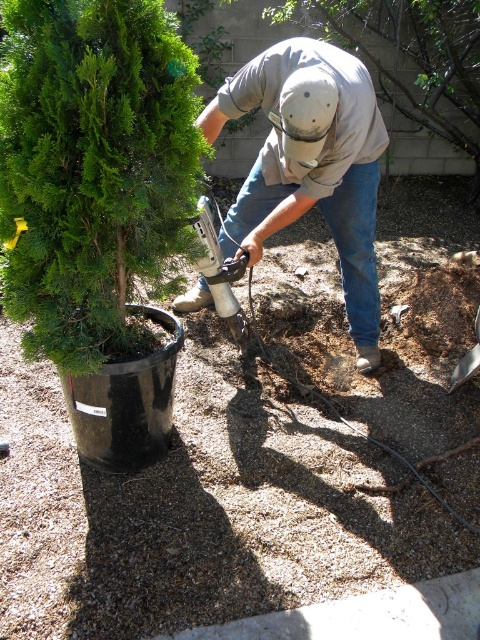
Does point (13, 68) lie behind point (391, 51)?

No, (13, 68) is closer to viewer.

Is green matte shrub at left taller than green matte tree at center?

Incorrect, green matte shrub at left's height is not larger of green matte tree at center's.

Between point (97, 33) and point (459, 124), which one is positioned in front?

Point (97, 33)

Locate an element on the screen. Image resolution: width=480 pixels, height=640 pixels. green matte shrub at left is located at coordinates (93, 166).

Between green matte shrub at left and gray fabric shirt at center, which one appears on the right side from the viewer's perspective?

From the viewer's perspective, gray fabric shirt at center appears more on the right side.

Between point (12, 177) and point (334, 225), which one is positioned in front?

Point (12, 177) is more forward.

The image size is (480, 640). Find the location of `green matte shrub at left`. green matte shrub at left is located at coordinates (93, 166).

Is point (285, 113) behind point (456, 19)?

No, it is in front of (456, 19).

Between gray fabric shirt at center and green matte tree at center, which one is positioned lower?

gray fabric shirt at center

Between point (245, 84) and point (396, 86), which one is positioned in front?

Point (245, 84)

Locate an element on the screen. gray fabric shirt at center is located at coordinates (311, 164).